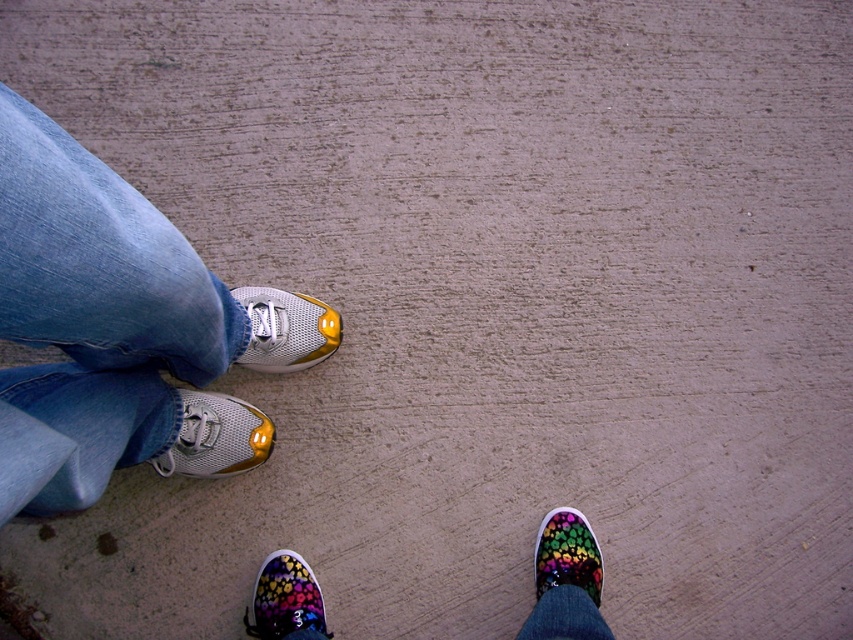
Between matte silver sneaker at lower left and jeans at lower right, which one is positioned lower?

Positioned lower is jeans at lower right.

Consider the image. Between matte silver sneaker at lower left and jeans at lower right, which one has more height?

matte silver sneaker at lower left is taller.

Is point (230, 442) positioned behind point (569, 634)?

Yes, point (230, 442) is farther from viewer.

At what (x,y) coordinates should I click in order to perform the action: click on matte silver sneaker at lower left. Please return your answer as a coordinate pair (x, y). Looking at the image, I should click on (216, 436).

Does shiny metallic sneaker at left appear under jeans at lower right?

Incorrect, shiny metallic sneaker at left is not positioned below jeans at lower right.

Does point (289, 349) come closer to viewer compared to point (596, 632)?

That is False.

Between point (259, 317) and point (554, 588), which one is positioned behind?

The point (259, 317) is behind.

The height and width of the screenshot is (640, 853). I want to click on shiny metallic sneaker at left, so click(x=286, y=330).

Is multicolored canvas shoe at lower right in front of jeans at lower right?

No, multicolored canvas shoe at lower right is behind jeans at lower right.

Which is above, multicolored canvas shoe at lower right or jeans at lower right?

multicolored canvas shoe at lower right

Which is in front, point (543, 524) or point (564, 625)?

Point (564, 625) is in front.

Find the location of a particular element. The height and width of the screenshot is (640, 853). multicolored canvas shoe at lower right is located at coordinates point(567,554).